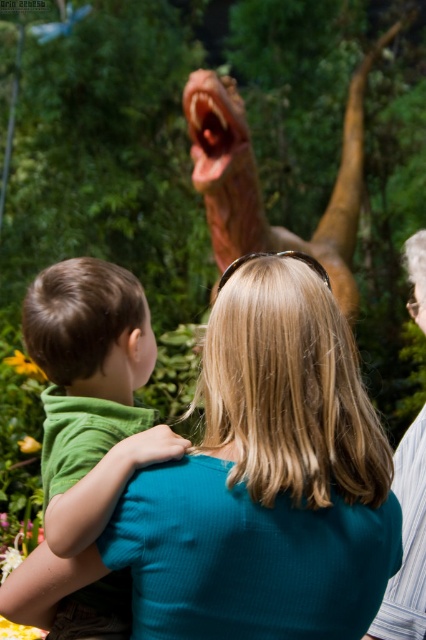
Is point (222, 627) farther from viewer compared to point (222, 141)?

No, (222, 627) is closer to viewer.

Between teal ribbed shirt at center and brown textured dinosaur at upper center, which one has less height?

teal ribbed shirt at center is shorter.

This screenshot has height=640, width=426. I want to click on teal ribbed shirt at center, so click(x=265, y=480).

Is brown textured dinosaur at upper center further to camera compared to striped fabric shirt at right?

Yes, brown textured dinosaur at upper center is behind striped fabric shirt at right.

Can you confirm if brown textured dinosaur at upper center is taller than striped fabric shirt at right?

Yes, brown textured dinosaur at upper center is taller than striped fabric shirt at right.

Locate an element on the screen. This screenshot has height=640, width=426. brown textured dinosaur at upper center is located at coordinates (258, 179).

Between teal ribbed shirt at center and striped fabric shirt at right, which one is positioned lower?

striped fabric shirt at right is lower down.

Between teal ribbed shirt at center and striped fabric shirt at right, which one has less height?

Standing shorter between the two is striped fabric shirt at right.

From the picture: Measure the distance between teal ribbed shirt at center and camera.

5.69 feet

Where is `teal ribbed shirt at center`? teal ribbed shirt at center is located at coordinates (265, 480).